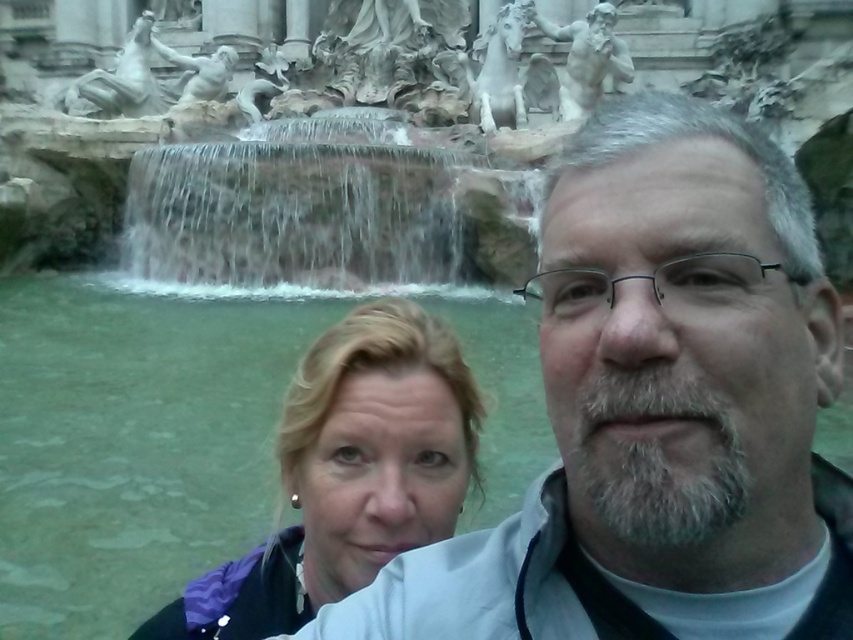
Can you confirm if gray hair at center is wider than rustic stone waterfall at center?

In fact, gray hair at center might be narrower than rustic stone waterfall at center.

Can you confirm if gray hair at center is positioned to the right of rustic stone waterfall at center?

Correct, you'll find gray hair at center to the right of rustic stone waterfall at center.

Find the location of a particular element. gray hair at center is located at coordinates (657, 406).

You are a GUI agent. You are given a task and a screenshot of the screen. Output one action in this format:
    pyautogui.click(x=<x>, y=<y>)
    Task: Click on the gray hair at center
    
    Given the screenshot: What is the action you would take?
    pyautogui.click(x=657, y=406)

Can you confirm if rustic stone waterfall at center is shorter than blonde hair at center?

In fact, rustic stone waterfall at center may be taller than blonde hair at center.

Between rustic stone waterfall at center and blonde hair at center, which one appears on the left side from the viewer's perspective?

rustic stone waterfall at center is more to the left.

Is point (241, 225) positioned behind point (312, 460)?

Yes.

Locate an element on the screen. rustic stone waterfall at center is located at coordinates (328, 205).

Is point (723, 285) positioned after point (434, 392)?

No, it is not.

Is gray hair at center in front of blonde hair at center?

Yes, gray hair at center is closer to the viewer.

At what (x,y) coordinates should I click in order to perform the action: click on gray hair at center. Please return your answer as a coordinate pair (x, y). Looking at the image, I should click on (657, 406).

You are a GUI agent. You are given a task and a screenshot of the screen. Output one action in this format:
    pyautogui.click(x=<x>, y=<y>)
    Task: Click on the gray hair at center
    The width and height of the screenshot is (853, 640).
    Given the screenshot: What is the action you would take?
    pyautogui.click(x=657, y=406)